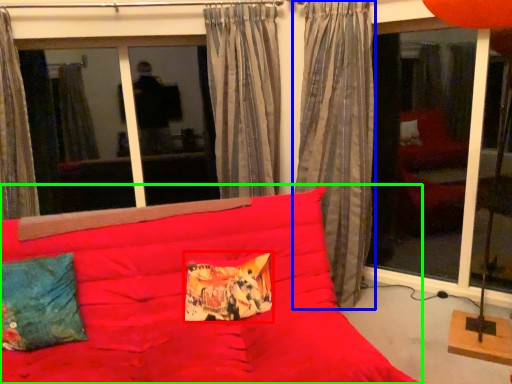
Question: Which object is positioned closest to pillow (highlighted by a red box)? Select from curtain (highlighted by a blue box) and studio couch (highlighted by a green box).

Choices:
 (A) curtain
 (B) studio couch

Answer: (B)